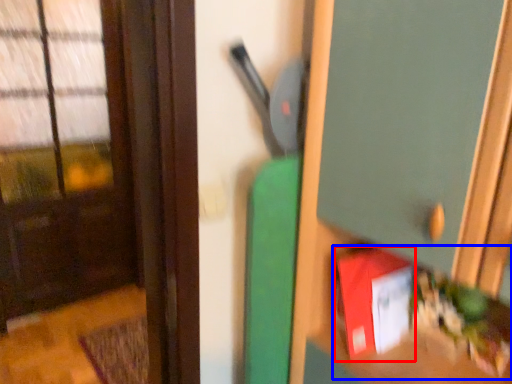
Question: Which object appears closest to the camera in this image, book (highlighted by a red box) or book (highlighted by a blue box)?

Choices:
 (A) book
 (B) book

Answer: (B)